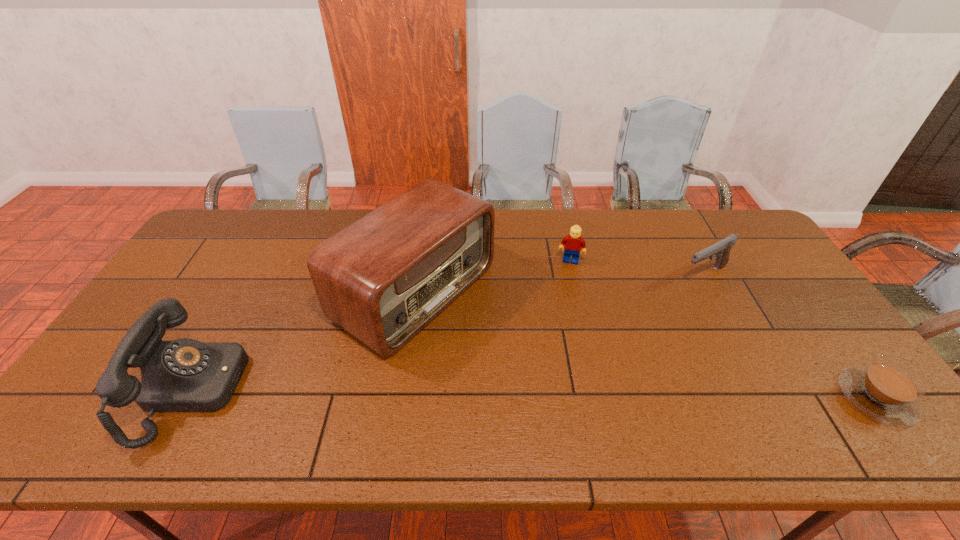
Find the location of a particular element. Image resolution: width=960 pixels, height=540 pixels. telephone positioned at the near edge is located at coordinates (185, 375).

This screenshot has width=960, height=540. Find the location of `cappuccino present at the near edge`. cappuccino present at the near edge is located at coordinates (887, 390).

This screenshot has width=960, height=540. What are the coordinates of `object located at the left edge` in the screenshot? It's located at (185, 375).

Where is `object positioned at the right edge`? The width and height of the screenshot is (960, 540). object positioned at the right edge is located at coordinates (887, 390).

The width and height of the screenshot is (960, 540). In order to click on object located at the near left corner in this screenshot , I will do [x=185, y=375].

Locate an element on the screen. object situated at the near right corner is located at coordinates (887, 390).

Where is `free point at the far edge`? free point at the far edge is located at coordinates (335, 224).

Find the location of a particular element. The image size is (960, 540). blank area at the right edge is located at coordinates (764, 293).

I want to click on vacant space at the far right corner of the desktop, so point(722,213).

Find the location of a particular element. The width and height of the screenshot is (960, 540). vacant space that is in between the second object from left to right and the cappuccino is located at coordinates (645, 345).